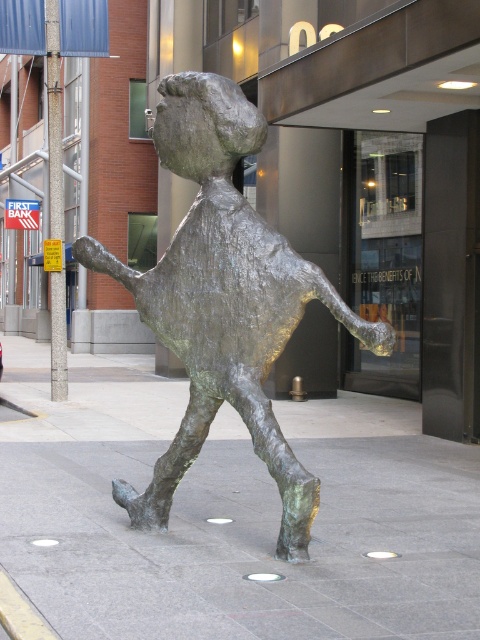
Question: Does green patina pavement at center have a smaller size compared to bronze statue at center?

Choices:
 (A) yes
 (B) no

Answer: (B)

Question: Does green patina pavement at center appear on the right side of bronze statue at center?

Choices:
 (A) yes
 (B) no

Answer: (B)

Question: Does green patina pavement at center appear over bronze statue at center?

Choices:
 (A) yes
 (B) no

Answer: (B)

Question: Which point is closer to the camera taking this photo?

Choices:
 (A) (83, 364)
 (B) (143, 296)

Answer: (B)

Question: Which object appears farthest from the camera in this image?

Choices:
 (A) green patina pavement at center
 (B) bronze statue at center

Answer: (B)